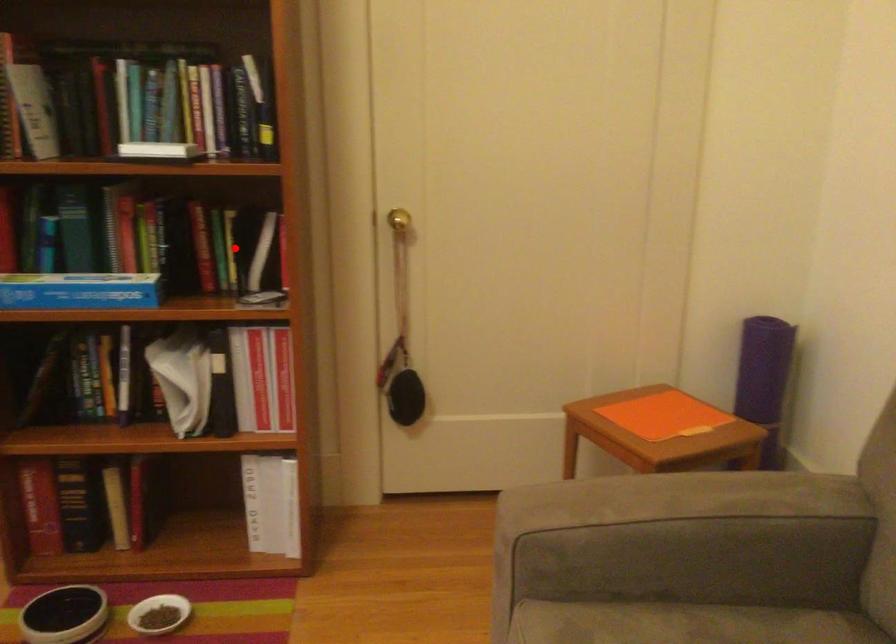
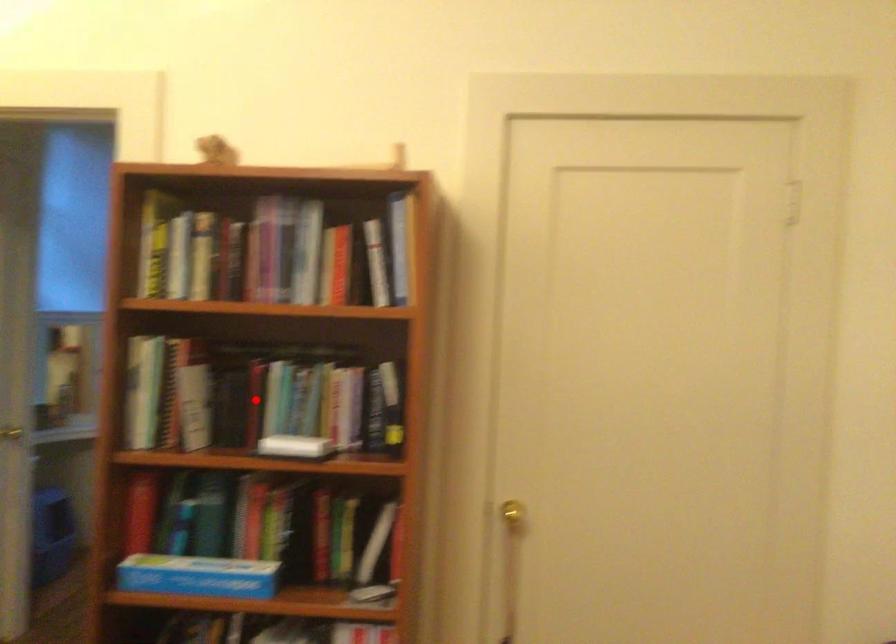
I am providing you with two images of the same scene from different viewpoints. A red point is marked on the first image and another point is marked on the second image. Does the point marked in image1 correspond to the same location as the one in image2?

No